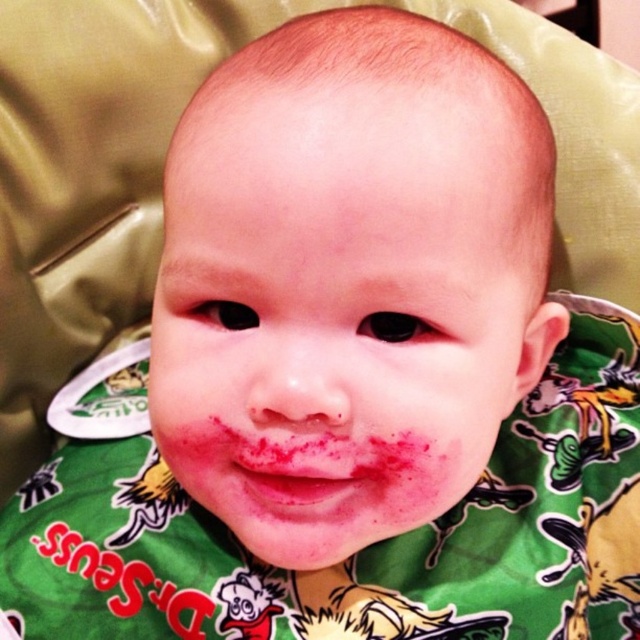
Looking at this image, you are a photographer taking a closeup shot of a baby. You notice the smooth skin face at center and the pink matte lips at center. Which one is positioned higher in the image?

The smooth skin face at center is positioned higher than the pink matte lips at center.

You are a photographer taking a close up shot of a baby. You notice the smooth skin face at center and the pink matte lips at center. Which object is positioned to the right side?

The smooth skin face at center is to the right of the pink matte lips at center.

You are a photographer adjusting your camera to focus on the baby in the image. Since you want to capture the smooth skin face at center and the pink matte lips at center clearly, which one should you focus on first to ensure both are in focus?

The smooth skin face at center is closer to the viewer than the pink matte lips at center. To ensure both are in focus, you should focus on the pink matte lips at center first, as focusing on the closer object allows for a deeper depth of field to include the farther object.